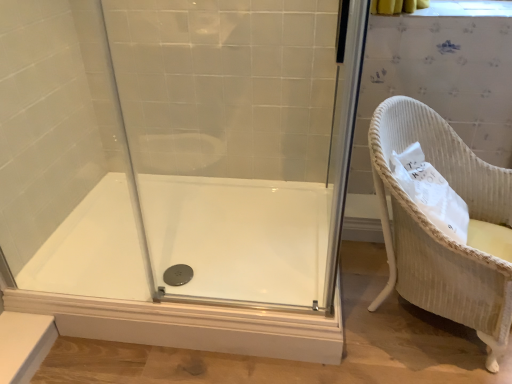
Question: From the image's perspective, is white wicker chair at right above or below white glossy bath at center?

Choices:
 (A) above
 (B) below

Answer: (A)

Question: Is white wicker chair at right to the left or to the right of white glossy bath at center in the image?

Choices:
 (A) right
 (B) left

Answer: (A)

Question: Which object is positioned farthest from the white wicker chair at right?

Choices:
 (A) transparent glass shower door at center
 (B) white glossy bath at center

Answer: (A)

Question: Which of these objects is positioned closest to the transparent glass shower door at center?

Choices:
 (A) white glossy bath at center
 (B) white wicker chair at right

Answer: (A)